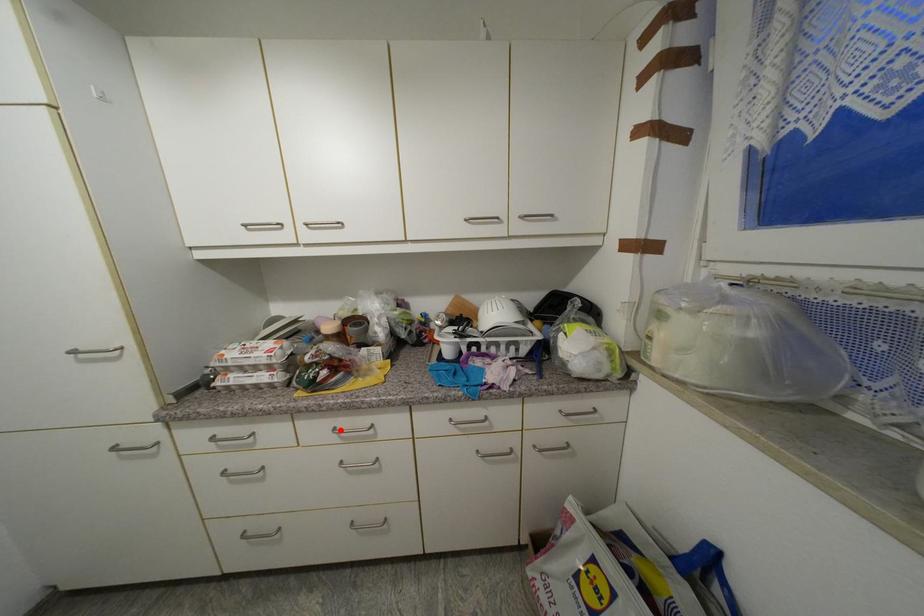
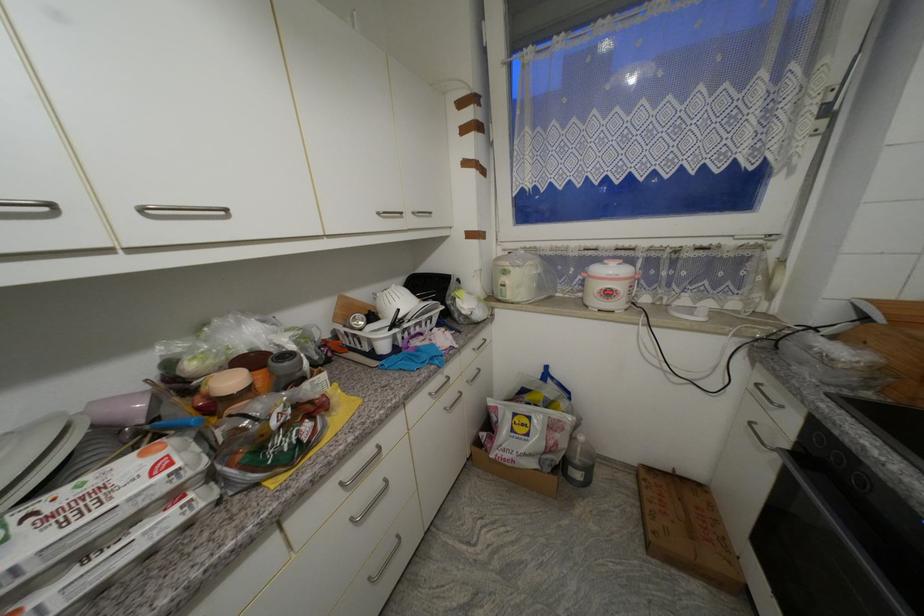
Find the pixel in the second image that matches the highlighted location in the first image.

(347, 485)